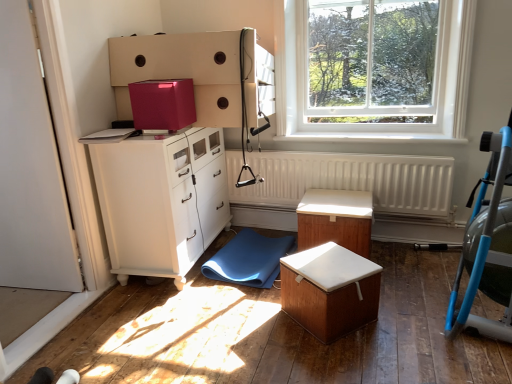
Question: Is wooden box with white cushion at center, marked as the second table in a back-to-front arrangement, to the right of white glossy cabinet at left from the viewer's perspective?

Choices:
 (A) no
 (B) yes

Answer: (B)

Question: From a real-world perspective, is wooden box with white cushion at center, marked as the first table in a front-to-back arrangement, located higher than white glossy cabinet at left?

Choices:
 (A) no
 (B) yes

Answer: (A)

Question: Is white glossy cabinet at left completely or partially inside wooden box with white cushion at center, marked as the first table in a front-to-back arrangement?

Choices:
 (A) yes
 (B) no

Answer: (B)

Question: Does wooden box with white cushion at center, marked as the first table in a front-to-back arrangement, have a lesser height compared to white glossy cabinet at left?

Choices:
 (A) no
 (B) yes

Answer: (B)

Question: Does wooden box with white cushion at center, marked as the first table in a front-to-back arrangement, have a greater width compared to white glossy cabinet at left?

Choices:
 (A) yes
 (B) no

Answer: (B)

Question: From the image's perspective, is wooden box with white cushion at center, marked as the first table in a front-to-back arrangement, beneath white glossy cabinet at left?

Choices:
 (A) no
 (B) yes

Answer: (B)

Question: From a real-world perspective, is white glossy cabinet at left under clear glass window at upper right?

Choices:
 (A) no
 (B) yes

Answer: (B)

Question: Considering the relative sizes of white glossy cabinet at left and clear glass window at upper right in the image provided, is white glossy cabinet at left thinner than clear glass window at upper right?

Choices:
 (A) yes
 (B) no

Answer: (B)

Question: Is white glossy cabinet at left bigger than clear glass window at upper right?

Choices:
 (A) yes
 (B) no

Answer: (A)

Question: Is white glossy cabinet at left oriented towards clear glass window at upper right?

Choices:
 (A) no
 (B) yes

Answer: (B)

Question: Is white glossy cabinet at left further to the viewer compared to clear glass window at upper right?

Choices:
 (A) yes
 (B) no

Answer: (B)

Question: From the image's perspective, is white glossy cabinet at left below clear glass window at upper right?

Choices:
 (A) no
 (B) yes

Answer: (B)

Question: Can you confirm if white matte radiator at center is shorter than wooden box with white cushion at center, marked as the first table in a front-to-back arrangement?

Choices:
 (A) yes
 (B) no

Answer: (B)